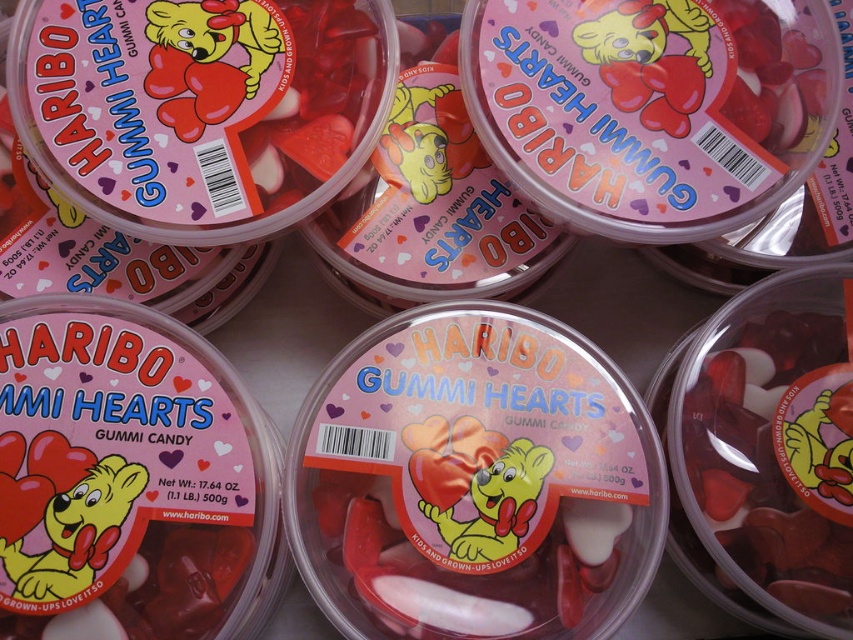
This screenshot has width=853, height=640. What do you see at coordinates (474, 481) in the screenshot?
I see `matte plastic gummi hearts at center` at bounding box center [474, 481].

Consider the image. Who is more forward, [364,458] or [537,124]?

Point [364,458]

The width and height of the screenshot is (853, 640). What are the coordinates of `matte plastic gummi hearts at center` in the screenshot? It's located at (474, 481).

Can you confirm if matte plastic gummi hearts at center is positioned to the right of translucent plastic container at center?

No, matte plastic gummi hearts at center is not to the right of translucent plastic container at center.

Locate an element on the screen. The width and height of the screenshot is (853, 640). matte plastic gummi hearts at center is located at coordinates (474, 481).

Is matte plastic container at upper center wider than translucent plastic container at center?

Yes.

Does matte plastic container at upper center appear over translucent plastic container at center?

Correct, matte plastic container at upper center is located above translucent plastic container at center.

Is point (555, 141) in front of point (805, 616)?

No.

Locate an element on the screen. matte plastic container at upper center is located at coordinates (653, 108).